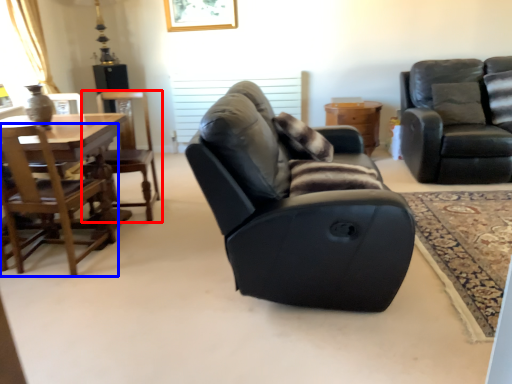
Question: Which of the following is the closest to the observer, chair (highlighted by a red box) or chair (highlighted by a blue box)?

Choices:
 (A) chair
 (B) chair

Answer: (B)